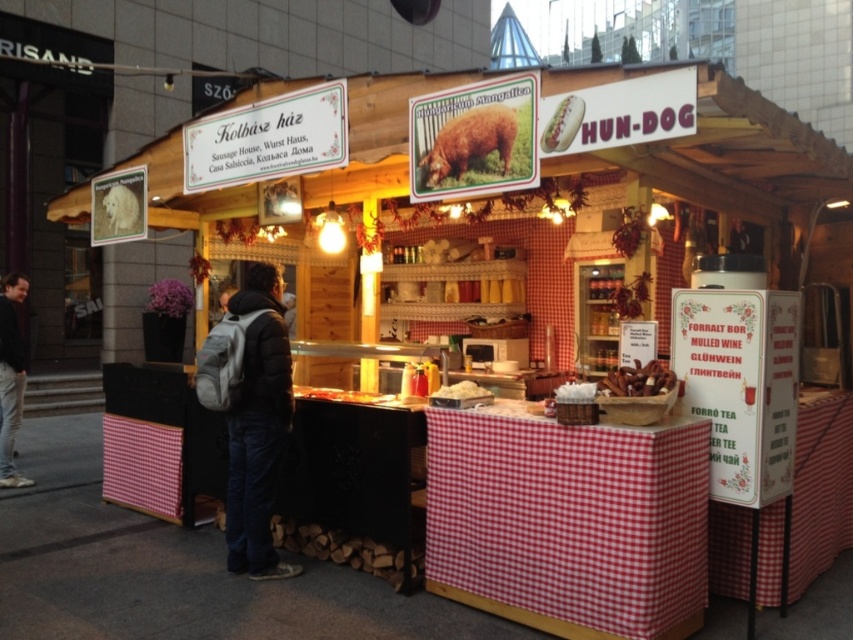
Who is positioned more to the left, dark gray sweater at left or white bread at upper center?

From the viewer's perspective, dark gray sweater at left appears more on the left side.

Is point (27, 481) more distant than point (544, 134)?

Yes, it is behind point (544, 134).

Where is `dark gray sweater at left`? This screenshot has height=640, width=853. dark gray sweater at left is located at coordinates (10, 376).

Can you confirm if dark gray sweater at left is positioned to the right of white fluffy bread at center?

Incorrect, dark gray sweater at left is not on the right side of white fluffy bread at center.

Where is `dark gray sweater at left`? dark gray sweater at left is located at coordinates 10,376.

Is brown crispy bread at right in front of golden brown bread at center?

That is True.

This screenshot has height=640, width=853. Find the location of `brown crispy bread at right`. brown crispy bread at right is located at coordinates (637, 380).